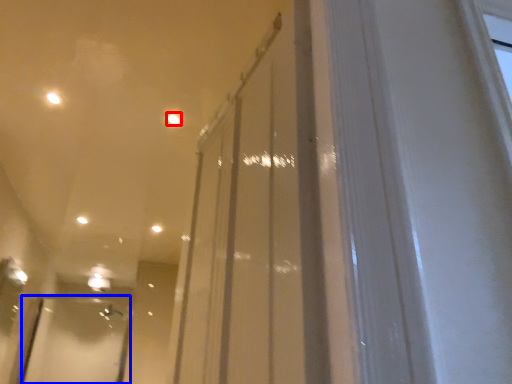
Question: Which object appears farthest to the camera in this image, light (highlighted by a red box) or screen door (highlighted by a blue box)?

Choices:
 (A) light
 (B) screen door

Answer: (B)